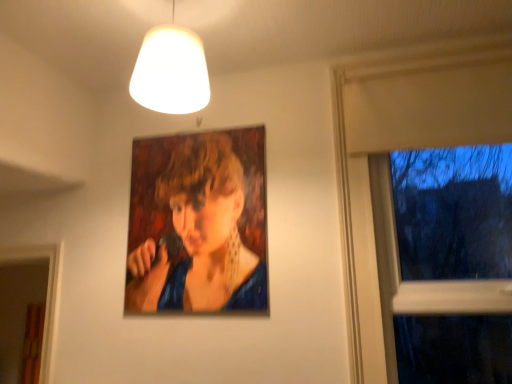
Question: In the image, is oil painting portrait at center positioned in front of or behind transparent glass window at right?

Choices:
 (A) front
 (B) behind

Answer: (B)

Question: Would you say oil painting portrait at center is to the left or to the right of transparent glass window at right in the picture?

Choices:
 (A) right
 (B) left

Answer: (B)

Question: Which is nearer to the white matte lampshade at upper center?

Choices:
 (A) transparent glass window at right
 (B) oil painting portrait at center

Answer: (B)

Question: Based on their relative distances, which object is farther from the white matte lampshade at upper center?

Choices:
 (A) transparent glass window at right
 (B) oil painting portrait at center

Answer: (A)